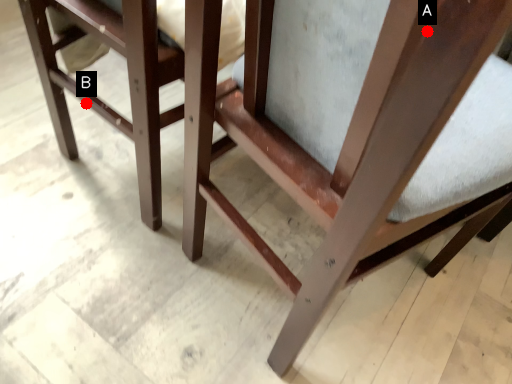
Question: Two points are circled on the image, labeled by A and B beside each circle. Which point is farther from the camera taking this photo?

Choices:
 (A) A is further
 (B) B is further

Answer: (B)